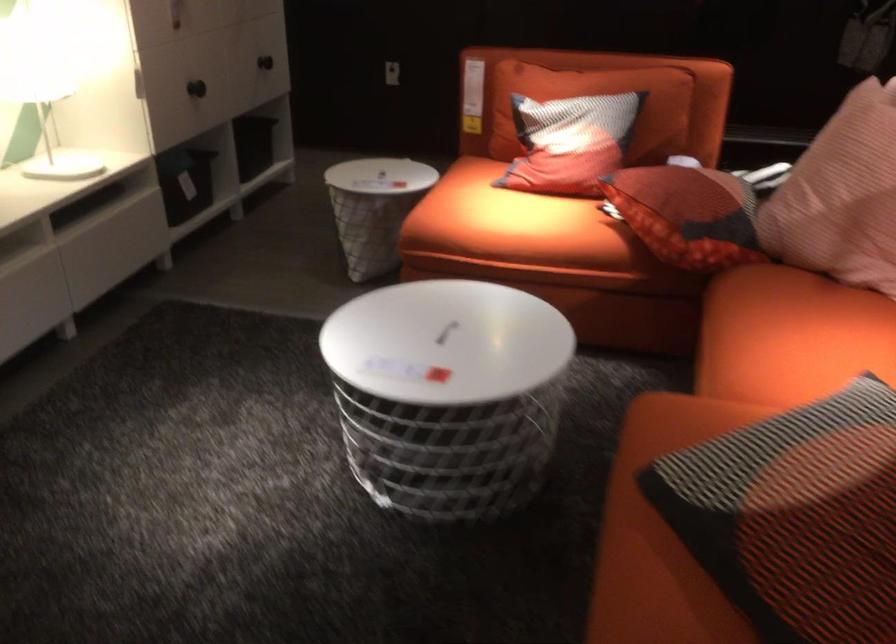
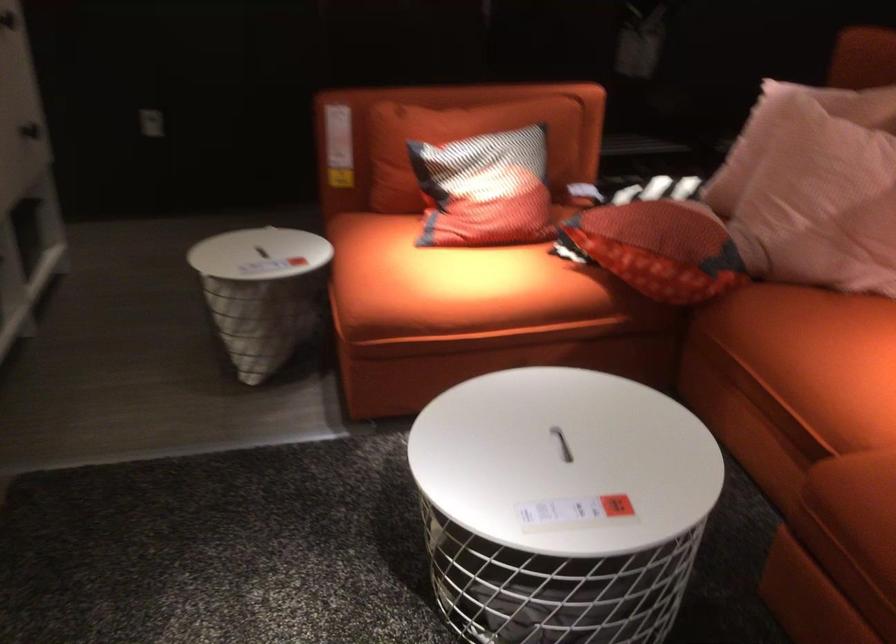
In the second image, find the point that corresponds to the point at 563,142 in the first image.

(485, 190)